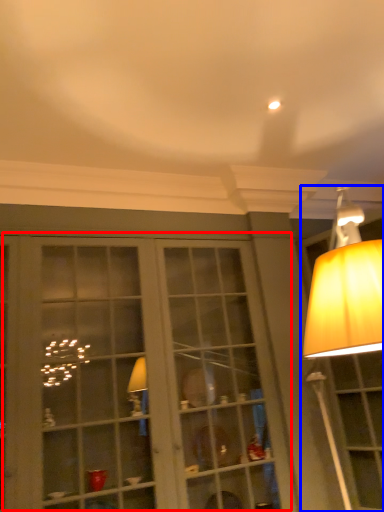
Question: Which point is further to the camera, bay window (highlighted by a red box) or lamp (highlighted by a blue box)?

Choices:
 (A) bay window
 (B) lamp

Answer: (B)